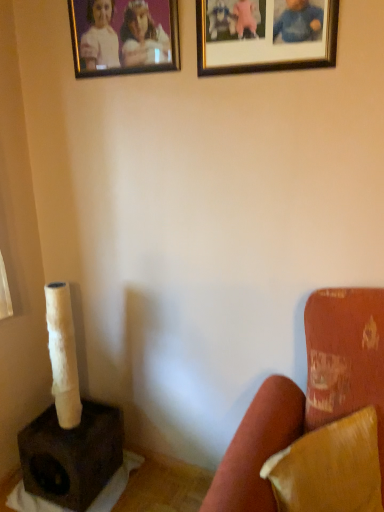
Question: Is gold-framed photo at upper center, which ranks as the first picture frame in left-to-right order, to the left or to the right of velvet red armchair at lower right in the image?

Choices:
 (A) left
 (B) right

Answer: (A)

Question: Does point (155, 3) appear closer or farther from the camera than point (309, 480)?

Choices:
 (A) farther
 (B) closer

Answer: (A)

Question: Which object is the farthest from the gold-framed picture at upper center, the 2th picture frame when ordered from left to right?

Choices:
 (A) leather-like brown pillow at lower right
 (B) dark brown matte speaker at lower left
 (C) velvet red armchair at lower right
 (D) gold-framed photo at upper center, which ranks as the first picture frame in left-to-right order

Answer: (B)

Question: Which of these objects is positioned closest to the gold-framed photo at upper center, which ranks as the first picture frame in left-to-right order?

Choices:
 (A) velvet red armchair at lower right
 (B) leather-like brown pillow at lower right
 (C) gold-framed picture at upper center, acting as the first picture frame starting from the right
 (D) dark brown matte speaker at lower left

Answer: (C)